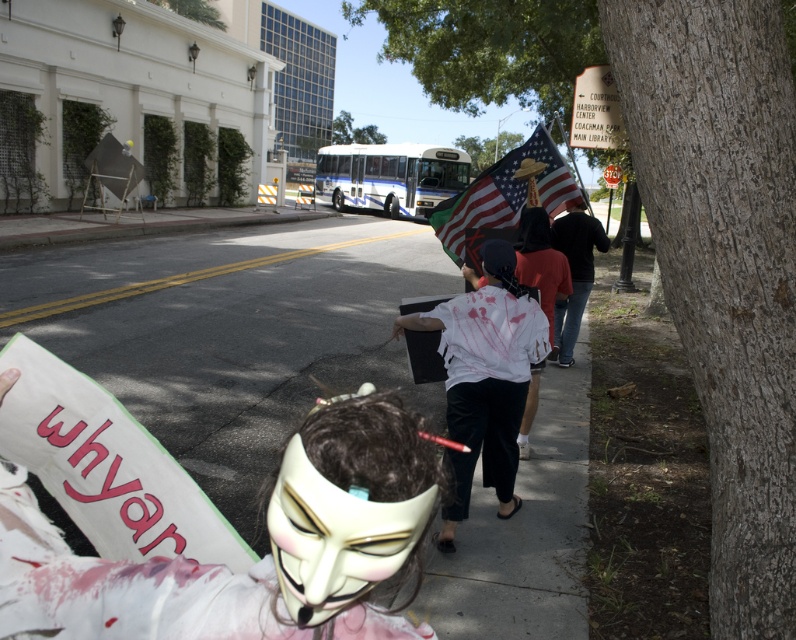
Who is lower down, white matte shirt at center or dark blue jeans at center?

Positioned lower is white matte shirt at center.

Is point (492, 388) closer to viewer compared to point (568, 310)?

That is True.

Between point (471, 448) and point (580, 237), which one is positioned in front?

Point (471, 448) is more forward.

Locate an element on the screen. The height and width of the screenshot is (640, 796). white matte shirt at center is located at coordinates (484, 378).

Does american flag at center lie in front of dark blue jeans at center?

Yes, american flag at center is closer to the viewer.

Between american flag at center and dark blue jeans at center, which one is positioned lower?

dark blue jeans at center is lower down.

Between point (486, 209) and point (591, 216), which one is positioned in front?

Point (486, 209)

Image resolution: width=796 pixels, height=640 pixels. I want to click on american flag at center, so click(x=504, y=193).

Is point (252, 336) farther from viewer compared to point (470, 474)?

Yes, point (252, 336) is farther from viewer.

Can you confirm if concrete sidewalk at center is positioned to the left of white matte shirt at center?

Indeed, concrete sidewalk at center is positioned on the left side of white matte shirt at center.

Is point (541, 532) less distant than point (498, 436)?

No, it is not.

Locate an element on the screen. Image resolution: width=796 pixels, height=640 pixels. concrete sidewalk at center is located at coordinates (232, 332).